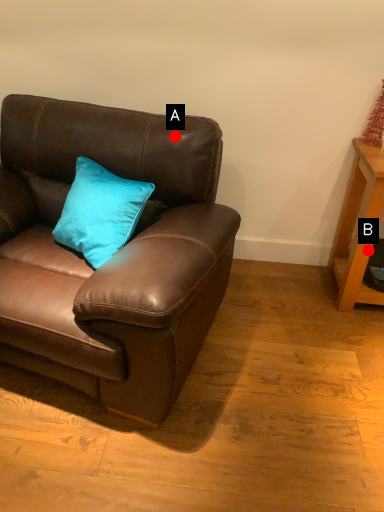
Question: Two points are circled on the image, labeled by A and B beside each circle. Which of the following is the closest to the observer?

Choices:
 (A) A is closer
 (B) B is closer

Answer: (A)